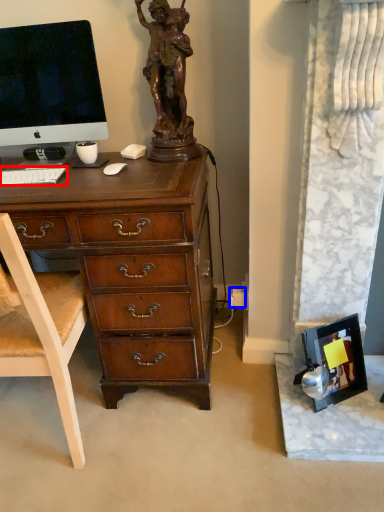
Question: Among these objects, which one is farthest to the camera, computer keyboard (highlighted by a red box) or power outlet (highlighted by a blue box)?

Choices:
 (A) computer keyboard
 (B) power outlet

Answer: (B)